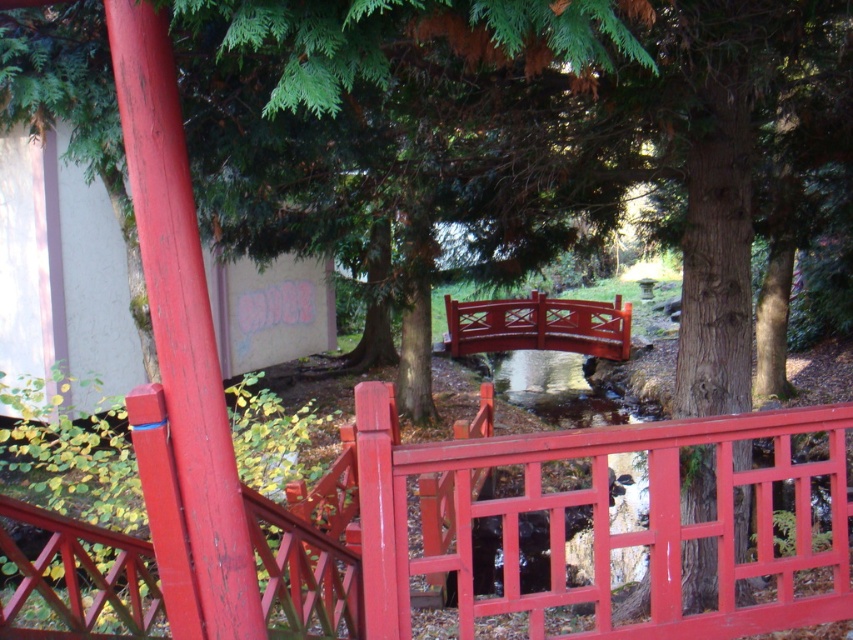
Question: Which point is farther to the camera?

Choices:
 (A) glossy wood bridge at center
 (B) smooth glossy wood bridge at center

Answer: (A)

Question: Does smooth glossy wood bridge at center have a lesser width compared to glossy wood bridge at center?

Choices:
 (A) no
 (B) yes

Answer: (B)

Question: Does smooth glossy wood bridge at center have a larger size compared to glossy wood bridge at center?

Choices:
 (A) yes
 (B) no

Answer: (B)

Question: Is smooth glossy wood bridge at center further to the viewer compared to glossy wood bridge at center?

Choices:
 (A) yes
 (B) no

Answer: (B)